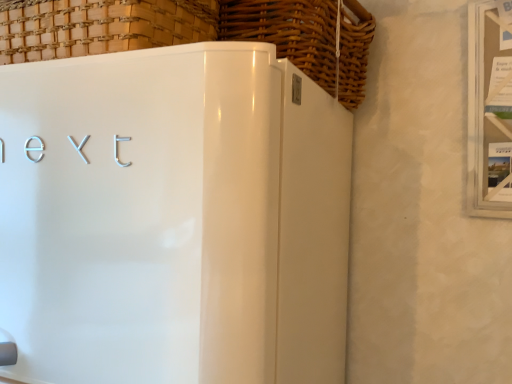
Question: Is woven wood basket at upper left, the second basket in the right-to-left sequence, behind woven wood basket at upper center, the 1th basket from the right?

Choices:
 (A) no
 (B) yes

Answer: (A)

Question: Can woven wood basket at upper center, the 1th basket from the right, be found inside woven wood basket at upper left, the 1th basket viewed from the left?

Choices:
 (A) no
 (B) yes

Answer: (A)

Question: From the image's perspective, is woven wood basket at upper left, the 1th basket viewed from the left, on woven wood basket at upper center, the 2th basket when ordered from left to right?

Choices:
 (A) yes
 (B) no

Answer: (B)

Question: From the image's perspective, is woven wood basket at upper left, the 1th basket viewed from the left, beneath woven wood basket at upper center, the 2th basket when ordered from left to right?

Choices:
 (A) yes
 (B) no

Answer: (A)

Question: From a real-world perspective, is woven wood basket at upper left, the 1th basket viewed from the left, below woven wood basket at upper center, the 2th basket when ordered from left to right?

Choices:
 (A) no
 (B) yes

Answer: (B)

Question: Are woven wood basket at upper left, the second basket in the right-to-left sequence, and woven wood basket at upper center, the 1th basket from the right, making contact?

Choices:
 (A) yes
 (B) no

Answer: (B)

Question: From the image's perspective, is white glossy refrigerator at center under woven wood basket at upper center, the 1th basket from the right?

Choices:
 (A) yes
 (B) no

Answer: (A)

Question: Is the depth of white glossy refrigerator at center less than that of woven wood basket at upper center, the 2th basket when ordered from left to right?

Choices:
 (A) yes
 (B) no

Answer: (A)

Question: Is white glossy refrigerator at center facing away from woven wood basket at upper center, the 2th basket when ordered from left to right?

Choices:
 (A) no
 (B) yes

Answer: (A)

Question: Considering the relative sizes of white glossy refrigerator at center and woven wood basket at upper center, the 1th basket from the right, in the image provided, is white glossy refrigerator at center shorter than woven wood basket at upper center, the 1th basket from the right,?

Choices:
 (A) yes
 (B) no

Answer: (B)

Question: Can you confirm if white glossy refrigerator at center is bigger than woven wood basket at upper center, the 1th basket from the right?

Choices:
 (A) yes
 (B) no

Answer: (A)

Question: From a real-world perspective, is white glossy refrigerator at center under woven wood basket at upper center, the 2th basket when ordered from left to right?

Choices:
 (A) yes
 (B) no

Answer: (A)

Question: Does woven wood basket at upper left, the 1th basket viewed from the left, have a greater height compared to white glossy refrigerator at center?

Choices:
 (A) yes
 (B) no

Answer: (B)